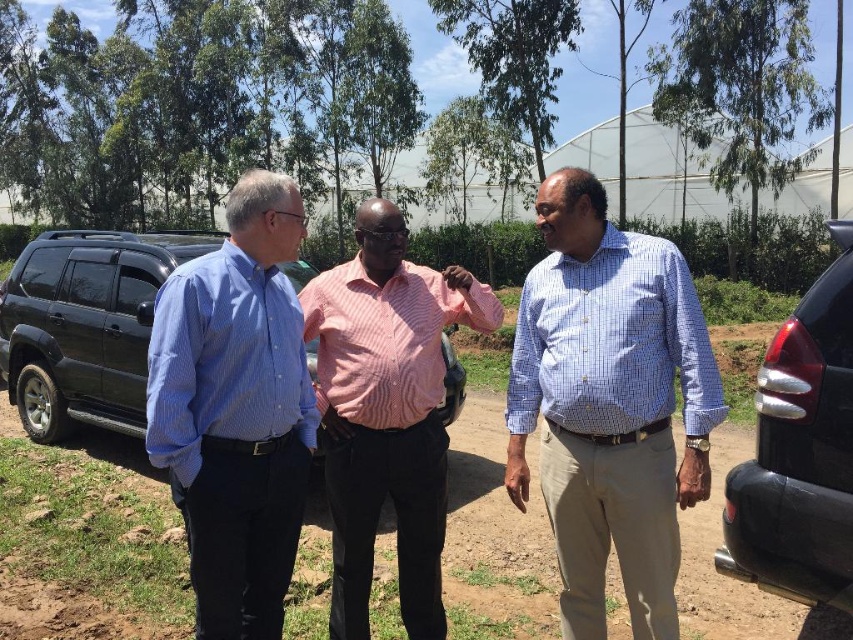
You are standing at the point marked as point (236, 410) and want to walk towards the blue striped shirt at left. Is the blue striped shirt at left located to your left or right side?

The blue striped shirt at left is located to your left side as you are facing the direction from point (236, 410).

You are standing at the origin point in the image. There is a blue checkered shirt at center represented by point (x=608, y=404). Can you tell me the coordinates of the blue checkered shirt at center?

The coordinates of the blue checkered shirt at center are point (x=608, y=404).